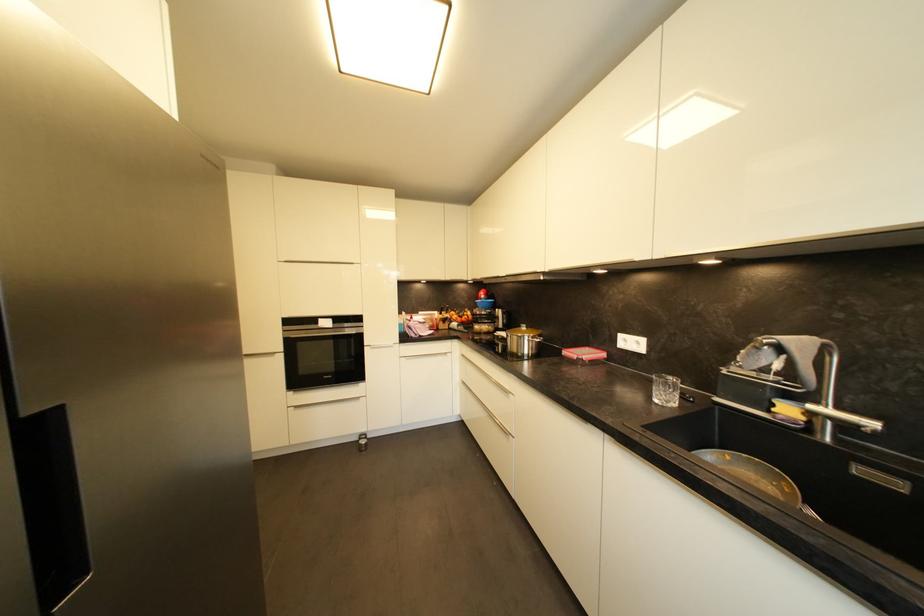
The image size is (924, 616). Describe the element at coordinates (51, 505) in the screenshot. I see `the refrigerator door handle` at that location.